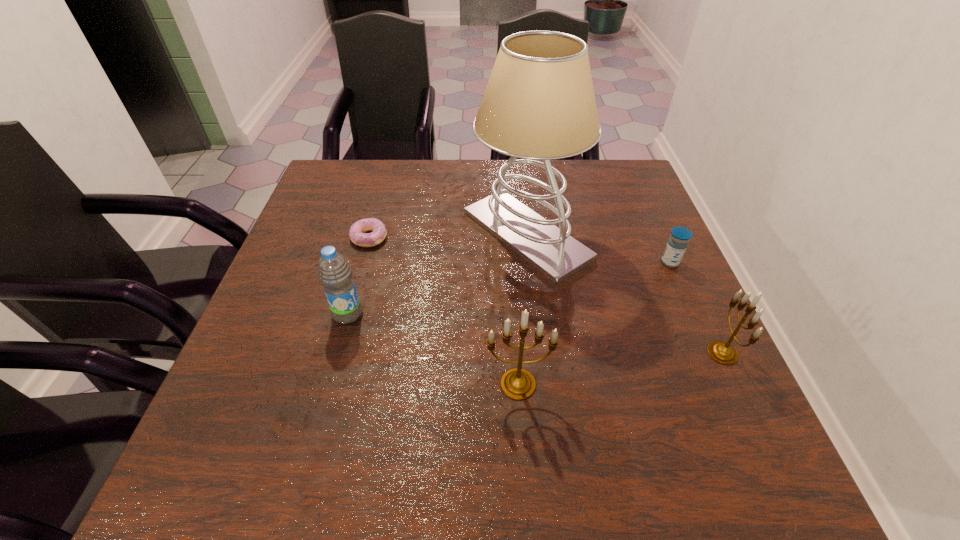
Please point a spot to add another candelabrum on the left. Please provide its 2D coordinates. Your answer should be formatted as a tuple, i.e. [(x, y)], where the tuple contains the x and y coordinates of a point satisfying the conditions above.

[(287, 418)]